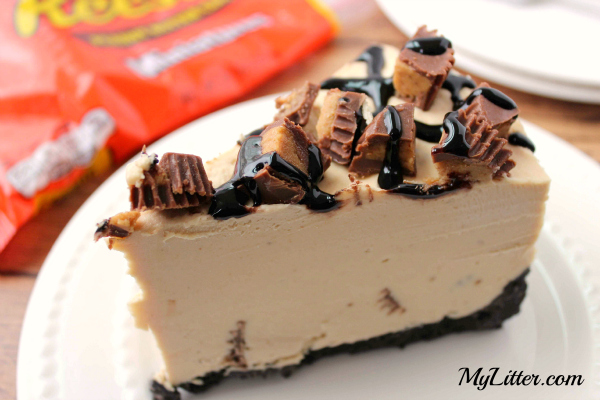
I want to click on other plate, so click(x=521, y=37).